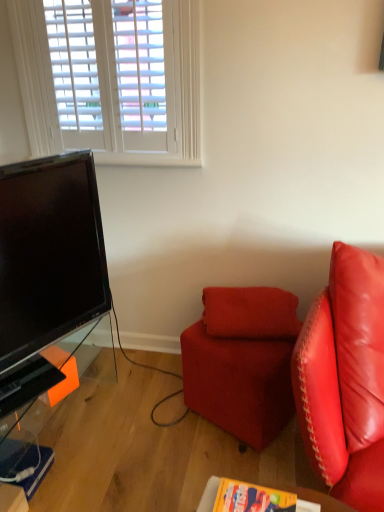
Question: Is the depth of velvet red ottoman at center less than that of suede-like red pillow at center?

Choices:
 (A) yes
 (B) no

Answer: (A)

Question: Is velvet red ottoman at center positioned with its back to suede-like red pillow at center?

Choices:
 (A) no
 (B) yes

Answer: (A)

Question: Can you confirm if velvet red ottoman at center is taller than suede-like red pillow at center?

Choices:
 (A) yes
 (B) no

Answer: (A)

Question: Is velvet red ottoman at center not inside suede-like red pillow at center?

Choices:
 (A) no
 (B) yes

Answer: (B)

Question: Is velvet red ottoman at center thinner than suede-like red pillow at center?

Choices:
 (A) yes
 (B) no

Answer: (B)

Question: Does velvet red ottoman at center have a greater width compared to suede-like red pillow at center?

Choices:
 (A) yes
 (B) no

Answer: (A)

Question: Is wooden table at lower center, which ranks as the second table in back-to-front order, shorter than suede-like red pillow at center?

Choices:
 (A) no
 (B) yes

Answer: (B)

Question: Can we say wooden table at lower center, which is counted as the first table, starting from the front, lies outside suede-like red pillow at center?

Choices:
 (A) no
 (B) yes

Answer: (B)

Question: Is wooden table at lower center, which ranks as the second table in back-to-front order, thinner than suede-like red pillow at center?

Choices:
 (A) no
 (B) yes

Answer: (B)

Question: Considering the relative positions of wooden table at lower center, which ranks as the second table in back-to-front order, and suede-like red pillow at center in the image provided, is wooden table at lower center, which ranks as the second table in back-to-front order, behind suede-like red pillow at center?

Choices:
 (A) no
 (B) yes

Answer: (A)

Question: Can suede-like red pillow at center be found inside wooden table at lower center, which is counted as the first table, starting from the front?

Choices:
 (A) no
 (B) yes

Answer: (A)

Question: Is wooden table at lower center, which is counted as the first table, starting from the front, smaller than suede-like red pillow at center?

Choices:
 (A) no
 (B) yes

Answer: (B)

Question: Is suede-like red pillow at center positioned behind velvet red ottoman at center?

Choices:
 (A) yes
 (B) no

Answer: (A)